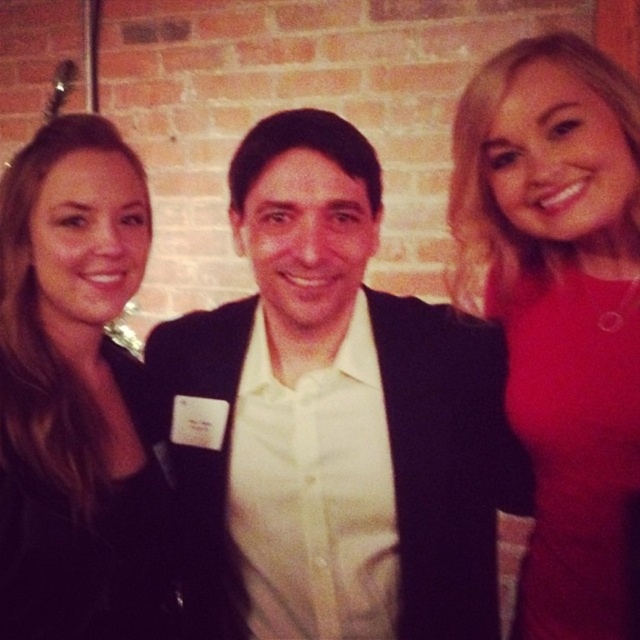
Who is higher up, black leather jacket at left or matte red dress at right?

black leather jacket at left

Between black leather jacket at left and matte red dress at right, which one appears on the right side from the viewer's perspective?

From the viewer's perspective, matte red dress at right appears more on the right side.

Is point (3, 232) positioned behind point (566, 417)?

No, it is not.

What are the coordinates of `black leather jacket at left` in the screenshot? It's located at (76, 397).

Can you confirm if white matte shirt at center is smaller than matte red dress at right?

Incorrect, white matte shirt at center is not smaller in size than matte red dress at right.

Between white matte shirt at center and matte red dress at right, which one is positioned lower?

Positioned lower is matte red dress at right.

Where is `white matte shirt at center`? white matte shirt at center is located at coordinates (332, 419).

The image size is (640, 640). Identify the location of white matte shirt at center. pos(332,419).

Who is taller, white matte shirt at center or black leather jacket at left?

black leather jacket at left

Does white matte shirt at center have a greater width compared to black leather jacket at left?

Yes.

Locate an element on the screen. This screenshot has width=640, height=640. white matte shirt at center is located at coordinates (332, 419).

In order to click on white matte shirt at center in this screenshot , I will do `click(332, 419)`.